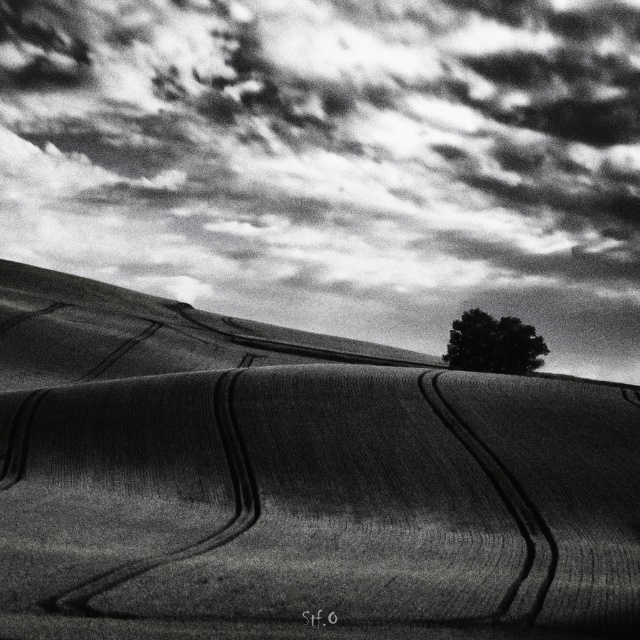
Which is behind, point (163, 486) or point (476, 337)?

Positioned behind is point (476, 337).

Is smooth soil at center bigger than dark green textured tree at center?

Indeed, smooth soil at center has a larger size compared to dark green textured tree at center.

Is point (316, 406) farther from camera compared to point (458, 348)?

No, it is not.

This screenshot has width=640, height=640. I want to click on smooth soil at center, so click(321, 499).

Is cloudy sky at upper center thinner than smooth soil at center?

Incorrect, cloudy sky at upper center's width is not less than smooth soil at center's.

Measure the distance between cloudy sky at upper center and camera.

cloudy sky at upper center is 84.92 meters away from camera.

Where is `cloudy sky at upper center`? The height and width of the screenshot is (640, 640). cloudy sky at upper center is located at coordinates (337, 161).

The width and height of the screenshot is (640, 640). I want to click on cloudy sky at upper center, so click(x=337, y=161).

Between cloudy sky at upper center and dark green textured tree at center, which one is positioned lower?

dark green textured tree at center is below.

Can you confirm if cloudy sky at upper center is thinner than dark green textured tree at center?

No, cloudy sky at upper center is not thinner than dark green textured tree at center.

Find the location of `cloudy sky at upper center`. cloudy sky at upper center is located at coordinates (337, 161).